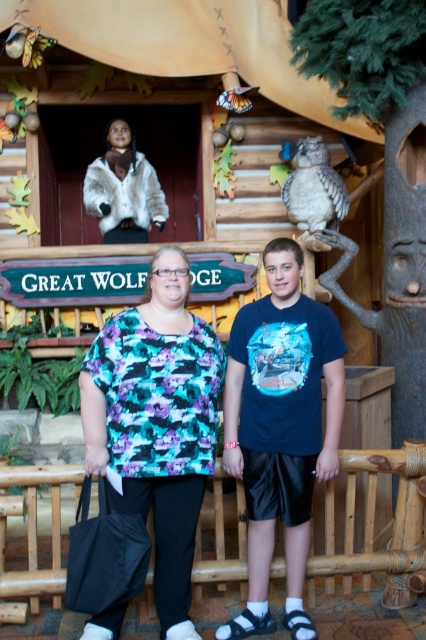
Question: Among these points, which one is farthest from the camera?

Choices:
 (A) (278, 301)
 (B) (187, 588)

Answer: (A)

Question: Does printed fabric blouse at center lie behind gray feathered owl at upper right?

Choices:
 (A) no
 (B) yes

Answer: (A)

Question: Can you confirm if navy blue t-shirt at center is positioned below gray feathered owl at upper right?

Choices:
 (A) no
 (B) yes

Answer: (B)

Question: Which of the following is the closest to the observer?

Choices:
 (A) (100, 420)
 (B) (294, 202)
 (C) (259, 417)

Answer: (A)

Question: Does printed fabric blouse at center lie in front of navy blue t-shirt at center?

Choices:
 (A) no
 (B) yes

Answer: (B)

Question: Which object is farther from the camera taking this photo?

Choices:
 (A) gray feathered owl at upper right
 (B) printed fabric blouse at center

Answer: (A)